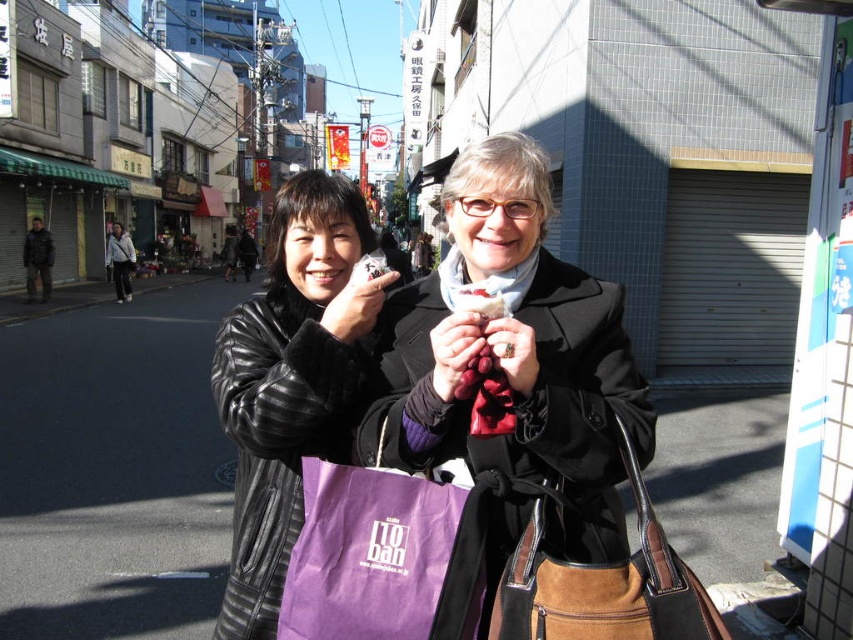
Who is positioned more to the left, purple fabric bag at center or brown suede bag at lower right?

purple fabric bag at center is more to the left.

Is point (479, 541) in front of point (509, 589)?

No.

Is point (318, 612) in front of point (556, 595)?

No.

You are a GUI agent. You are given a task and a screenshot of the screen. Output one action in this format:
    pyautogui.click(x=<x>, y=<y>)
    Task: Click on the purple fabric bag at center
    This screenshot has height=640, width=853.
    Given the screenshot: What is the action you would take?
    pyautogui.click(x=383, y=556)

Between leather jacket at center and dark brown leather jacket at left, which one appears on the right side from the viewer's perspective?

Positioned to the right is leather jacket at center.

Which of these two, leather jacket at center or dark brown leather jacket at left, stands taller?

With more height is dark brown leather jacket at left.

You are a GUI agent. You are given a task and a screenshot of the screen. Output one action in this format:
    pyautogui.click(x=<x>, y=<y>)
    Task: Click on the leather jacket at center
    This screenshot has height=640, width=853.
    Given the screenshot: What is the action you would take?
    pyautogui.click(x=503, y=356)

At what (x,y) coordinates should I click in order to perform the action: click on leather jacket at center. Please return your answer as a coordinate pair (x, y). The image size is (853, 640). Looking at the image, I should click on (503, 356).

Is black leather jacket at center further to the viewer compared to brown suede bag at lower right?

That is True.

Does black leather jacket at center have a greater height compared to brown suede bag at lower right?

Correct, black leather jacket at center is much taller as brown suede bag at lower right.

Is point (268, 628) farther from viewer compared to point (527, 634)?

Yes, it is behind point (527, 634).

Where is `black leather jacket at center`? This screenshot has width=853, height=640. black leather jacket at center is located at coordinates (291, 381).